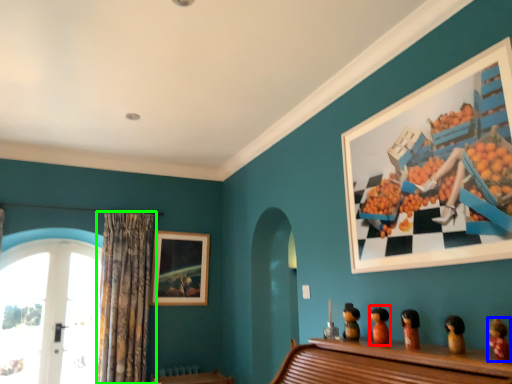
Question: Based on their relative distances, which object is farther from toy (highlighted by a red box)? Choose from toy (highlighted by a blue box) and curtain (highlighted by a green box).

Choices:
 (A) toy
 (B) curtain

Answer: (B)